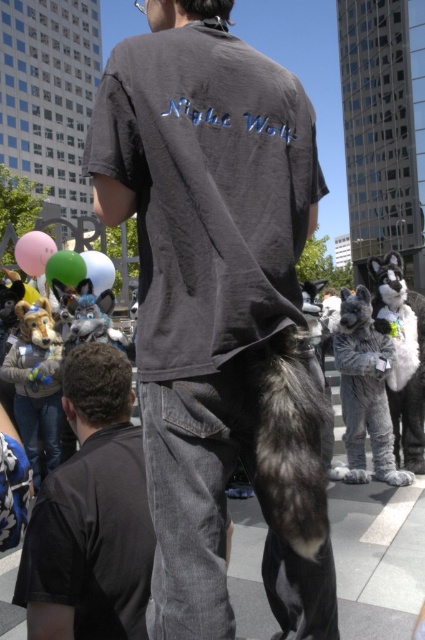
In the scene shown: You are at an outdoor event and see a gray furry dog at right and a pink rubber balloon at lower left. Which object is positioned lower in the image?

The gray furry dog at right is located below the pink rubber balloon at lower left, so the gray furry dog at right is positioned lower in the image.